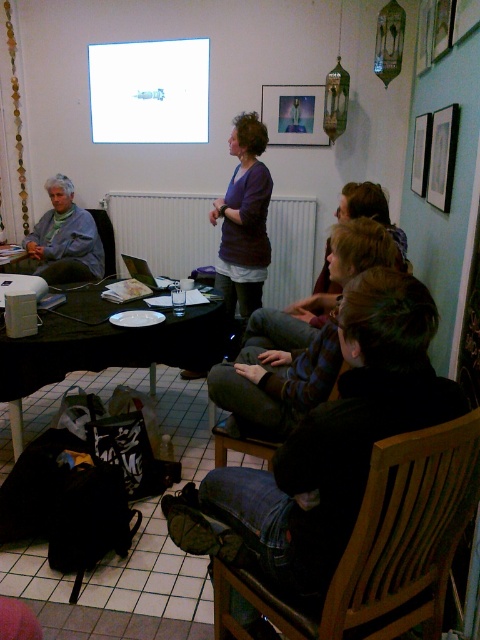
You are an attendee at the presentation. You notice the purple matte shirt at center and the matte glass picture frame at upper center. Which object is positioned higher in the image?

The matte glass picture frame at upper center is positioned higher than the purple matte shirt at center.

You are standing at the entrance of the room and want to sit down. There is a wooden chair at lower center located at point (239, 445). Can you walk directly to the wooden chair at lower center without moving around any obstacles?

Yes, you can walk directly to the wooden chair at lower center located at point (239, 445) because there are no obstacles mentioned in the scene description between the entrance and the chair.

You are an attendee sitting at the back of the room and want to see the projector screen clearly. Which object between the white matte radiator at center and the white glossy projector screen at upper center is closer to you?

The white glossy projector screen at upper center is farther away than the white matte radiator at center, so the radiator is closer to you. To see the screen clearly, you might need to move closer to the front of the room.